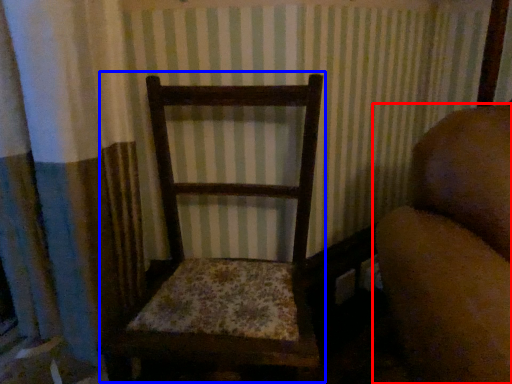
Question: Among these objects, which one is farthest to the camera, furniture (highlighted by a red box) or rocking chair (highlighted by a blue box)?

Choices:
 (A) furniture
 (B) rocking chair

Answer: (B)